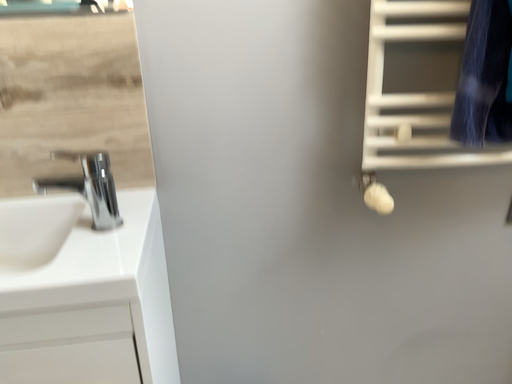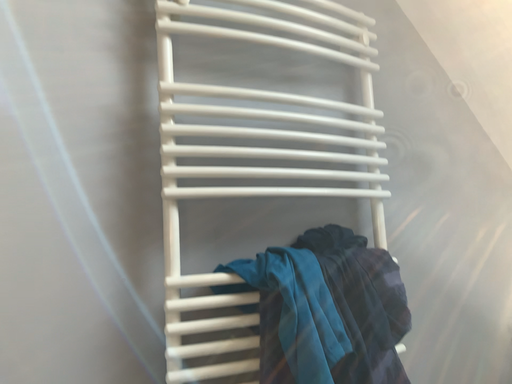
Question: Which way did the camera rotate in the video?

Choices:
 (A) rotated upward
 (B) rotated downward

Answer: (A)